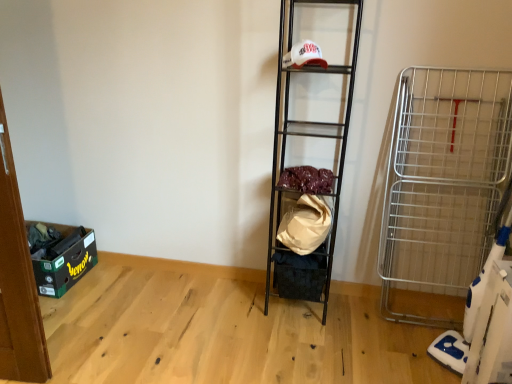
Question: Is velvet-like fabric at center, which appears as the second material when ordered from the bottom, inside or outside of silver metallic cart at right?

Choices:
 (A) outside
 (B) inside

Answer: (A)

Question: Looking at their shapes, would you say velvet-like fabric at center, acting as the first material starting from the top, is wider or thinner than silver metallic cart at right?

Choices:
 (A) thin
 (B) wide

Answer: (A)

Question: Which is farther from the green cardboard storage box at lower left, the 2th storage box positioned from the right?

Choices:
 (A) metallic black shelf at center
 (B) silver metallic cart at right
 (C) black fabric storage box at center, the 1th storage box when ordered from right to left
 (D) velvet-like fabric at center, which appears as the second material when ordered from the bottom
 (E) beige fabric bag at center, acting as the first material starting from the bottom

Answer: (B)

Question: Which object is positioned farthest from the metallic black shelf at center?

Choices:
 (A) velvet-like fabric at center, acting as the first material starting from the top
 (B) black fabric storage box at center, the 1th storage box when ordered from right to left
 (C) silver metallic cart at right
 (D) beige fabric bag at center, which ranks as the 2th material in top-to-bottom order
 (E) green cardboard storage box at lower left, the 2th storage box positioned from the right

Answer: (E)